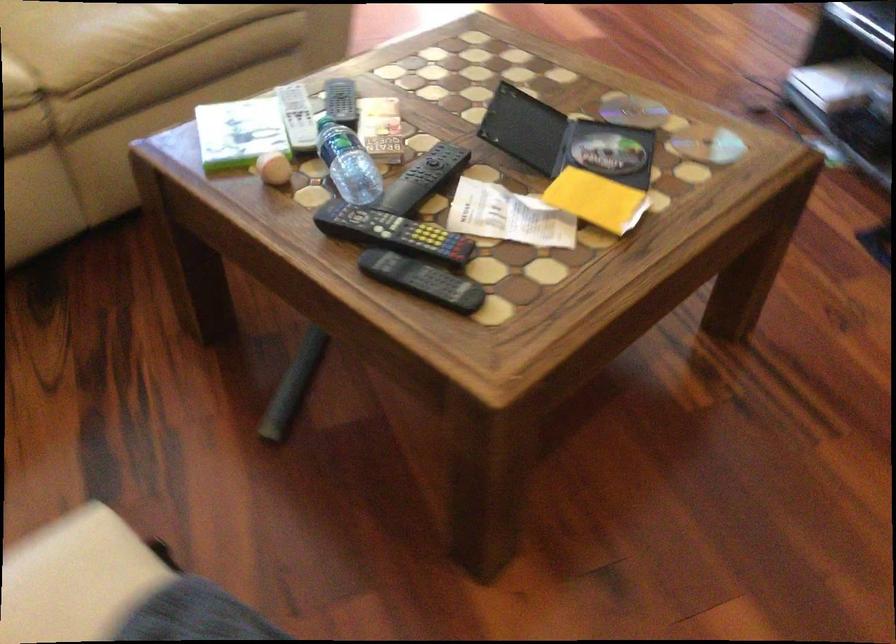
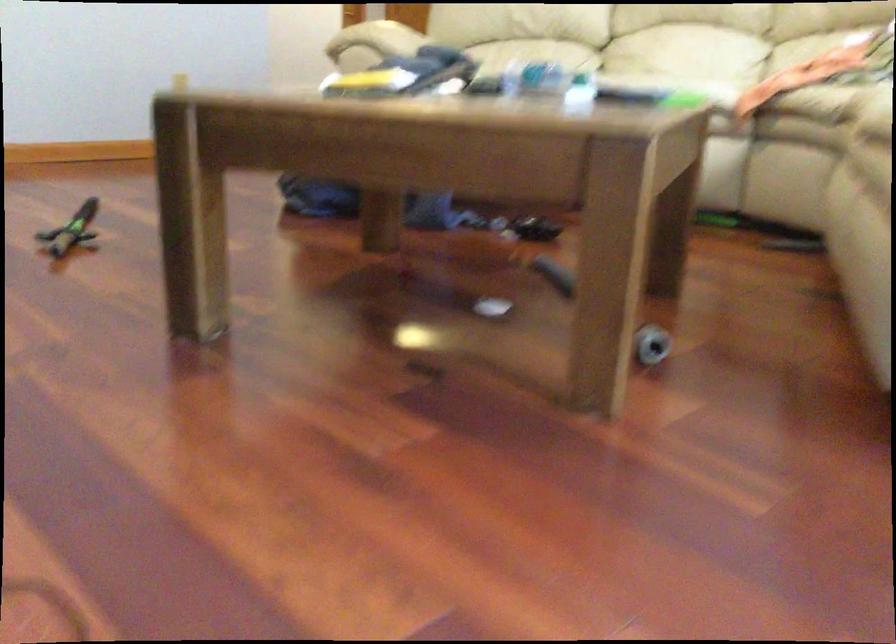
The point at (375, 96) is marked in the first image. Where is the corresponding point in the second image?

(580, 93)